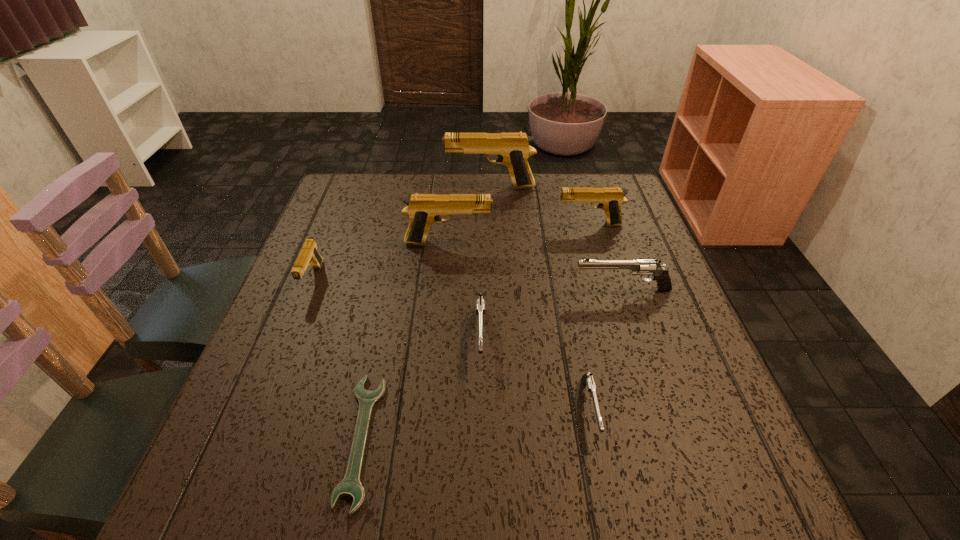
Where is `vacant space located 0.390m at the barrel of the third tallest pistol`? Image resolution: width=960 pixels, height=540 pixels. vacant space located 0.390m at the barrel of the third tallest pistol is located at coordinates (413, 225).

Locate an element on the screen. free location located 0.300m at the barrel of the third tallest pistol is located at coordinates (445, 225).

Where is `vacant region located 0.220m on the front-facing side of the biggest silver pistol`? The height and width of the screenshot is (540, 960). vacant region located 0.220m on the front-facing side of the biggest silver pistol is located at coordinates (478, 289).

At what (x,y) coordinates should I click in order to perform the action: click on free space located 0.130m on the front-facing side of the biggest silver pistol. Please return your answer as a coordinate pair (x, y). This screenshot has width=960, height=540. Looking at the image, I should click on (516, 289).

The height and width of the screenshot is (540, 960). In order to click on vacant space located 0.070m on the front-facing side of the biggest silver pistol in this screenshot , I will do `click(543, 289)`.

This screenshot has height=540, width=960. Identify the location of free space located 0.330m at the barrel of the leftmost pistol. (249, 440).

This screenshot has height=540, width=960. Find the location of `free location located on the front-facing side of the second smallest silver pistol`. free location located on the front-facing side of the second smallest silver pistol is located at coordinates (481, 465).

The width and height of the screenshot is (960, 540). In order to click on vacant space located on the front-facing side of the second shortest object in this screenshot , I will do `click(605, 482)`.

This screenshot has height=540, width=960. Identify the location of vacant point located 0.100m on the right of the shortest object. (436, 440).

You are a GUI agent. You are given a task and a screenshot of the screen. Output one action in this format:
    pyautogui.click(x=<x>, y=<y>)
    Task: Click on the object situated at the far edge
    
    Given the screenshot: What is the action you would take?
    pyautogui.click(x=513, y=150)